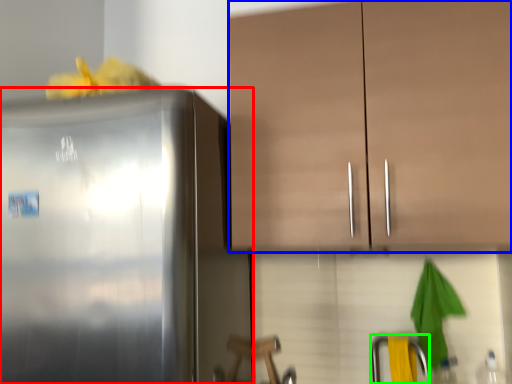
Question: Based on their relative distances, which object is nearer to refrigerator (highlighted by a red box)? Choose from cabinetry (highlighted by a blue box) and faucet (highlighted by a green box).

Choices:
 (A) cabinetry
 (B) faucet

Answer: (A)